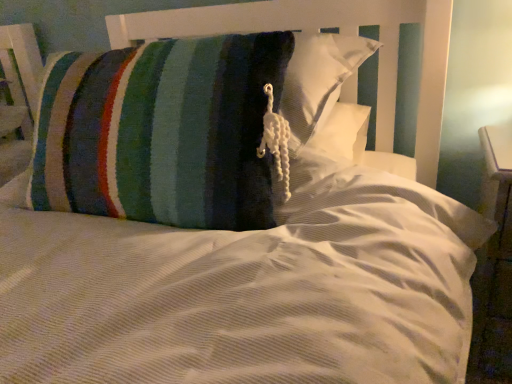
Question: Is knitted striped pillow at center in front of or behind white glossy dresser at right in the image?

Choices:
 (A) front
 (B) behind

Answer: (A)

Question: Visually, is knitted striped pillow at center positioned to the left or to the right of white glossy dresser at right?

Choices:
 (A) left
 (B) right

Answer: (A)

Question: From a real-world perspective, is knitted striped pillow at center physically located above or below white glossy dresser at right?

Choices:
 (A) below
 (B) above

Answer: (B)

Question: In terms of width, does white glossy dresser at right look wider or thinner when compared to knitted striped pillow at center?

Choices:
 (A) wide
 (B) thin

Answer: (B)

Question: Considering the positions of white glossy dresser at right and knitted striped pillow at center in the image, is white glossy dresser at right bigger or smaller than knitted striped pillow at center?

Choices:
 (A) small
 (B) big

Answer: (A)

Question: Is white glossy dresser at right inside the boundaries of knitted striped pillow at center, or outside?

Choices:
 (A) inside
 (B) outside

Answer: (B)

Question: From the image's perspective, relative to knitted striped pillow at center, is white glossy dresser at right above or below?

Choices:
 (A) below
 (B) above

Answer: (A)